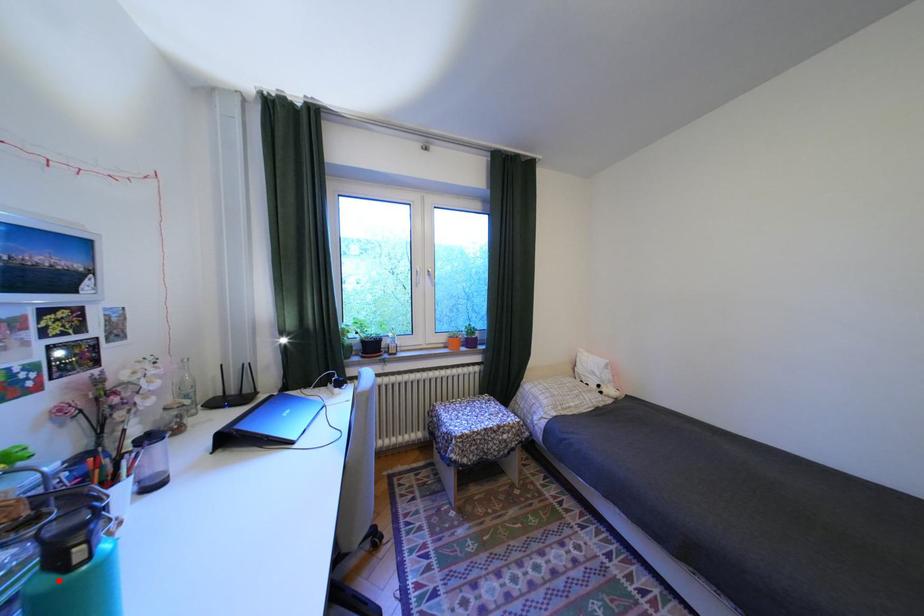
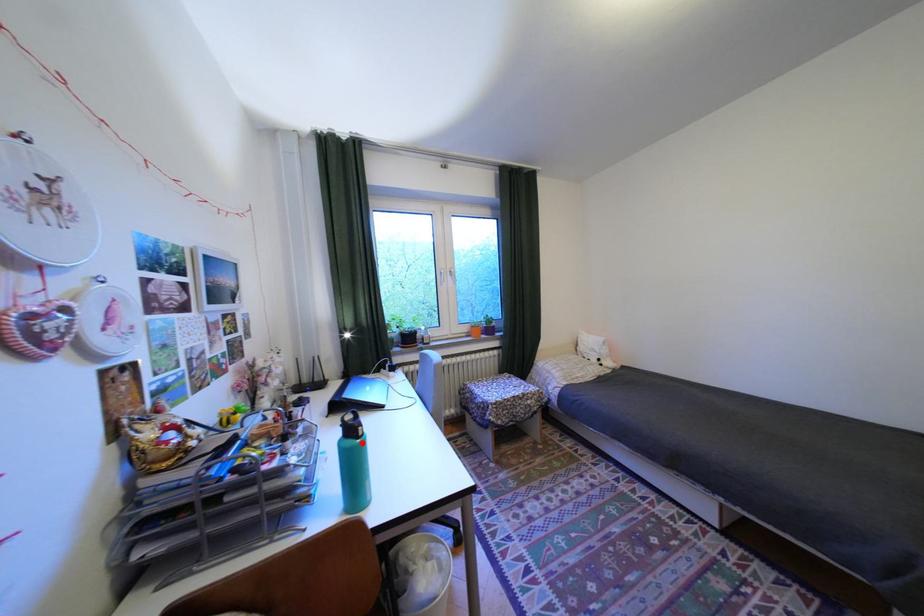
I am providing you with two images of the same scene from different viewpoints. A red point is marked on the first image and another point is marked on the second image. Is the marked point in image1 the same physical position as the marked point in image2?

Yes